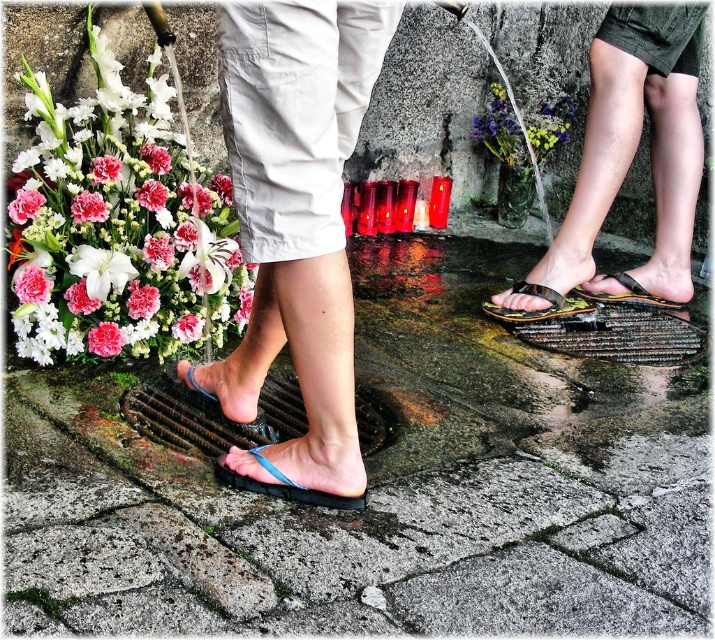
You are standing at the memorial site and want to place a flower at the base of the stone wall. The flower needs to be placed exactly 8 feet away from your current position. If you are facing the wall, where should you position the flower relative to the black textured sandals at lower right?

The black textured sandals at lower right are 7.89 feet away from you. To place the flower exactly 8 feet away from your current position, you should position it slightly beyond the black textured sandals at lower right, as they are just short of the required distance.

Based on the photo, where is the black rubber sandal at center located in the image?

The black rubber sandal at center is located at point (541, 308).